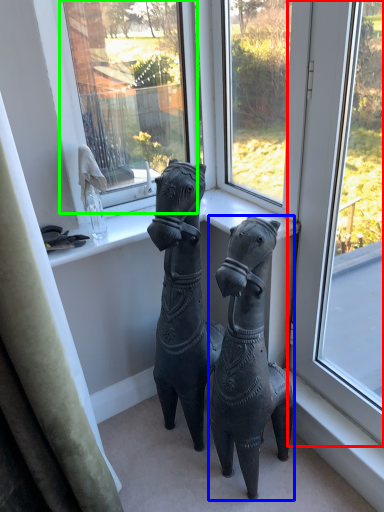
Question: Which is nearer to the window (highlighted by a red box)? horse (highlighted by a blue box) or window screen (highlighted by a green box).

Choices:
 (A) horse
 (B) window screen

Answer: (A)